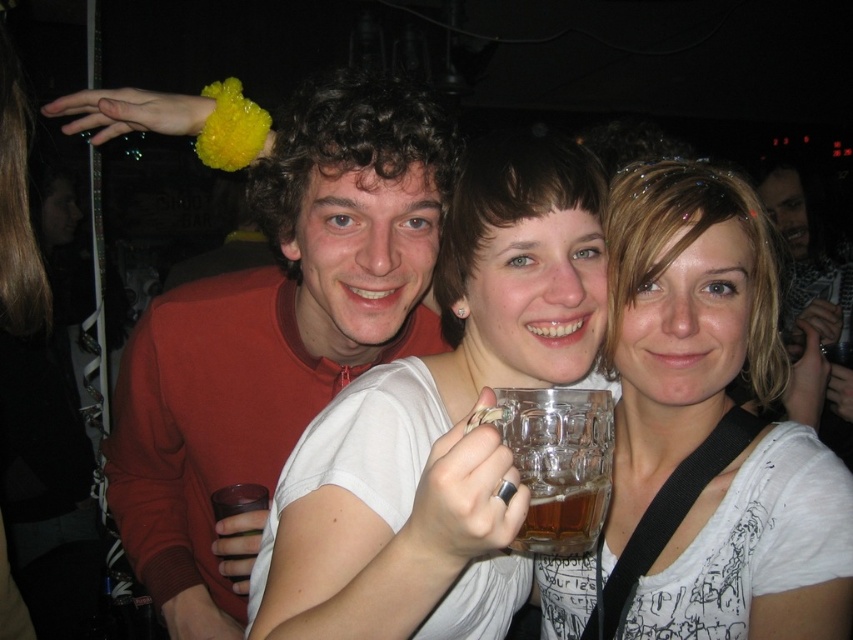
You are at a party and want to find the person wearing the white matte shirt at center. What are the coordinates where you should look?

The white matte shirt at center is located at coordinates point (442, 420).

You are at a party and want to take a photo of the white matte shirt at center and the transparent glass mug at center. Which object is larger in size?

The white matte shirt at center is bigger than the transparent glass mug at center, so the white matte shirt at center is larger in size.

You are at a party and want to take a photo of the two points in the image. The first point is at coordinates point (x=329, y=580) and the second point is at point (x=589, y=410). If you want to ensure both points are visible in your photo, which point should you focus on first to avoid blocking the other?

Point (x=329, y=580) is behind point (x=589, y=410), so you should focus on point (x=589, y=410) first to avoid blocking the other point.